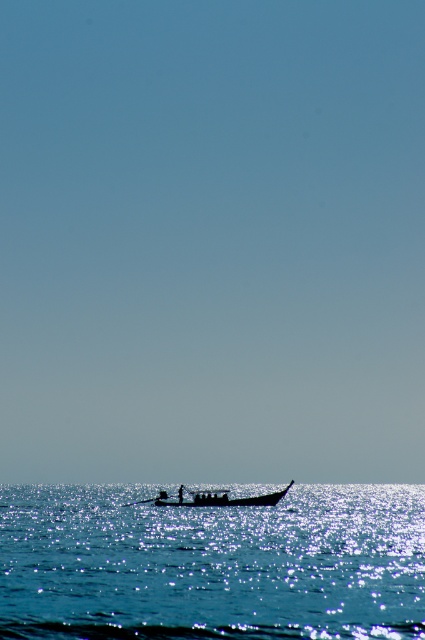
Question: Does glistening blue water at lower center appear on the right side of black wood paddle at center?

Choices:
 (A) no
 (B) yes

Answer: (B)

Question: Which point is closer to the camera?

Choices:
 (A) (161, 492)
 (B) (178, 506)
 (C) (226, 630)

Answer: (C)

Question: Is glistening blue water at lower center in front of black wood paddle at center?

Choices:
 (A) yes
 (B) no

Answer: (A)

Question: Which object appears closest to the camera in this image?

Choices:
 (A) silhouette wooden boat at center
 (B) black wood paddle at center
 (C) glistening blue water at lower center

Answer: (C)

Question: Is glistening blue water at lower center to the right of black wood paddle at center from the viewer's perspective?

Choices:
 (A) yes
 (B) no

Answer: (A)

Question: Which is nearer to the black wood paddle at center?

Choices:
 (A) glistening blue water at lower center
 (B) silhouette wooden boat at center

Answer: (B)